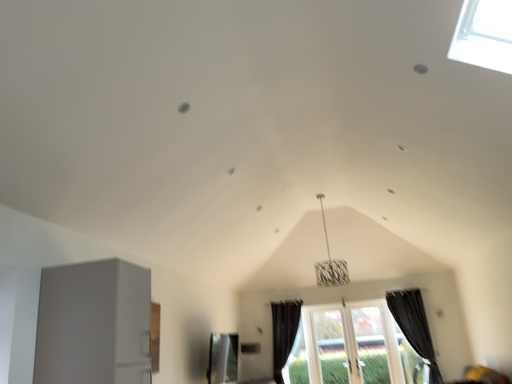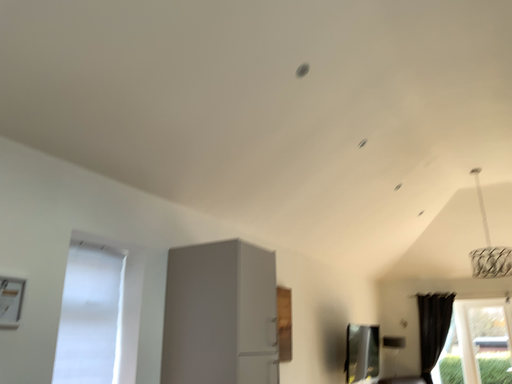
Question: Which way did the camera rotate in the video?

Choices:
 (A) rotated right
 (B) rotated left

Answer: (B)